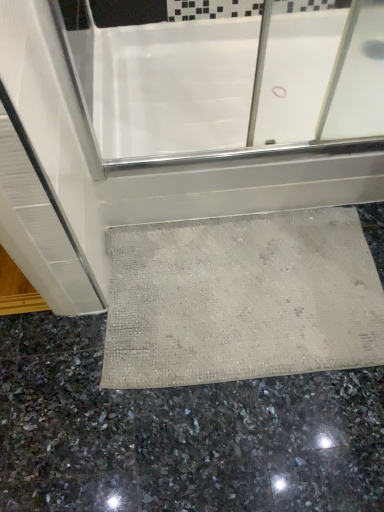
Identify the location of vacant area on top of gray polished granite at lower center (from a real-world perspective). This screenshot has height=512, width=384. (199, 401).